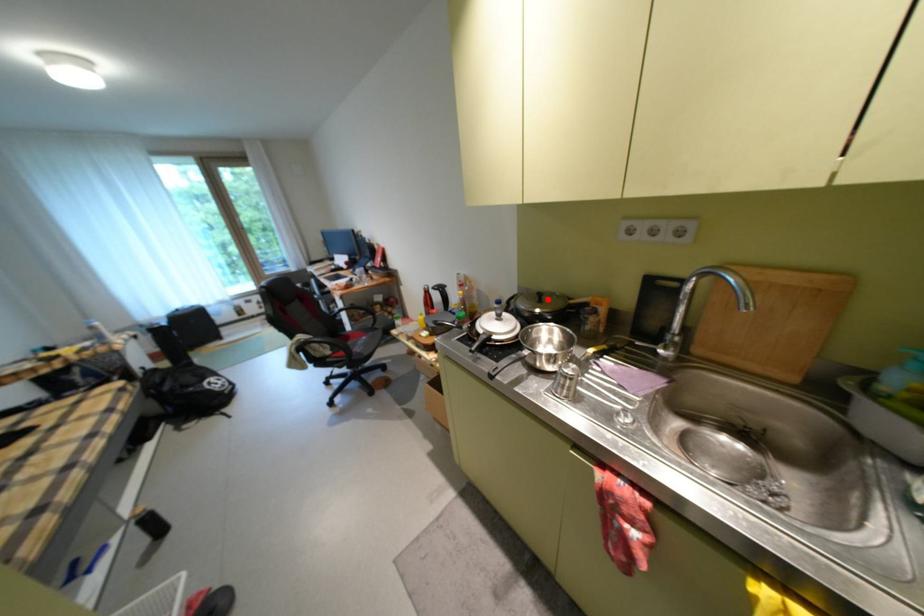
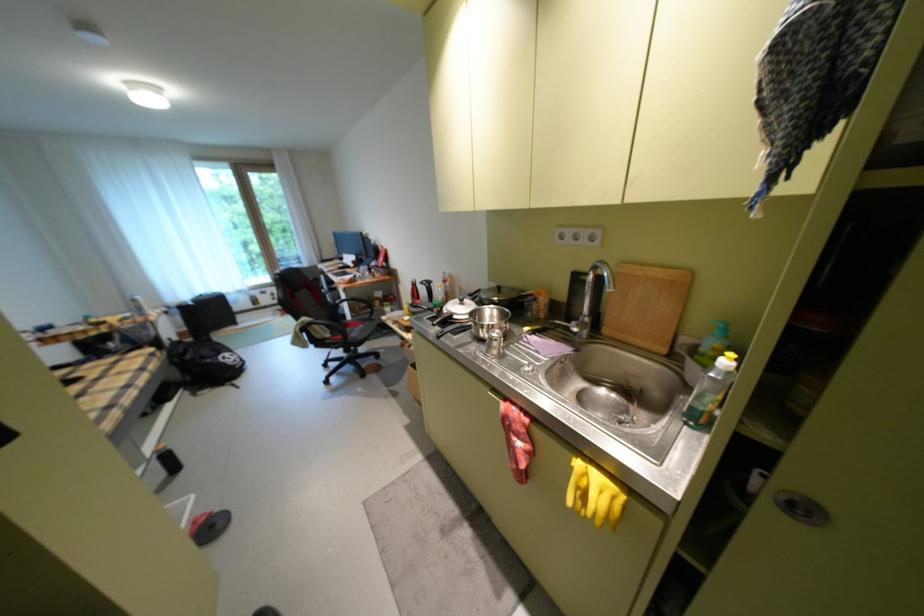
Where in the second image is the point corresponding to the highlighted location from the first image?

(507, 292)